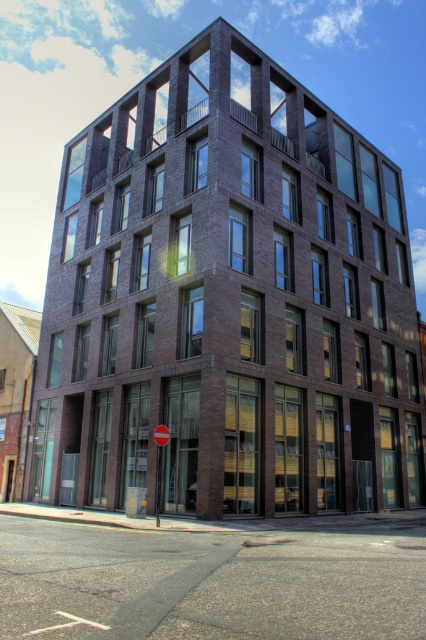
Is point (155, 500) behind point (166, 433)?

That is True.

Locate an element on the screen. yellow plastic street sign at lower center is located at coordinates (158, 461).

Locate an element on the screen. Image resolution: width=426 pixels, height=640 pixels. yellow plastic street sign at lower center is located at coordinates (158, 461).

This screenshot has width=426, height=640. I want to click on yellow plastic street sign at lower center, so click(x=158, y=461).